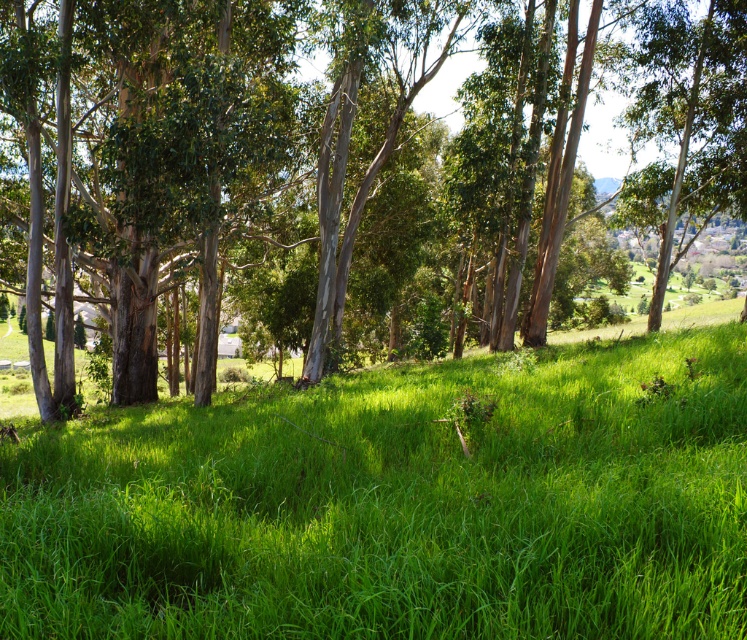
Question: Among these points, which one is nearest to the camera?

Choices:
 (A) (681, 616)
 (B) (335, 156)

Answer: (A)

Question: Does green grassy field at center appear on the right side of green smooth tree at center?

Choices:
 (A) no
 (B) yes

Answer: (A)

Question: Which object appears farthest from the camera in this image?

Choices:
 (A) green smooth tree at center
 (B) green grassy field at center

Answer: (A)

Question: Is green grassy field at center positioned behind green smooth tree at center?

Choices:
 (A) no
 (B) yes

Answer: (A)

Question: Which point is closer to the camera taking this photo?

Choices:
 (A) (238, 595)
 (B) (202, 188)

Answer: (A)

Question: Is the position of green grassy field at center less distant than that of green smooth tree at center?

Choices:
 (A) yes
 (B) no

Answer: (A)